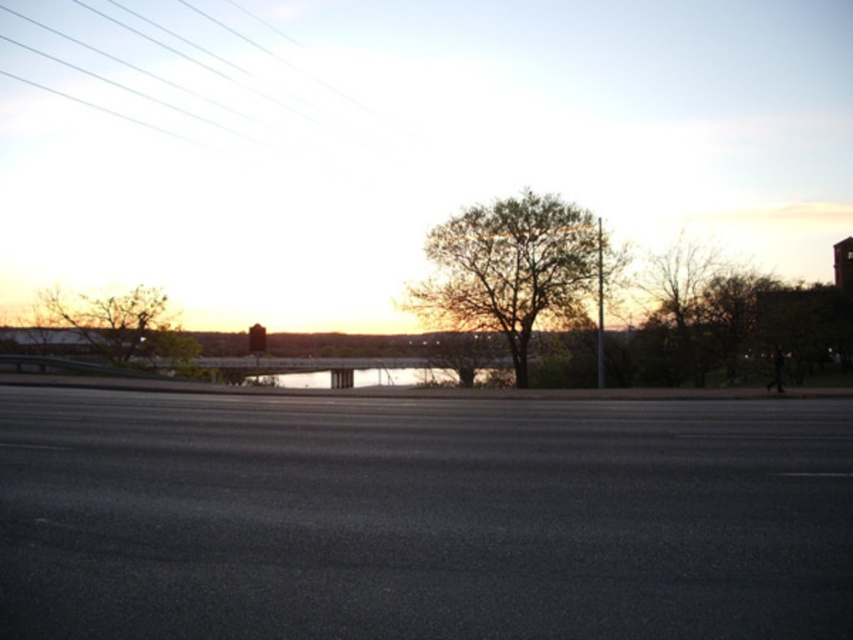
Question: Does clear glass power lines at upper left have a larger size compared to green leafy tree at center?

Choices:
 (A) yes
 (B) no

Answer: (A)

Question: Is green leafy tree at center bigger than green leafy tree at left?

Choices:
 (A) no
 (B) yes

Answer: (B)

Question: Which object appears farthest from the camera in this image?

Choices:
 (A) bare branches at right
 (B) clear glass power lines at upper left
 (C) green leafy tree at center

Answer: (B)

Question: Where is green leafy tree at center located in relation to green leafy tree at left in the image?

Choices:
 (A) above
 (B) below

Answer: (A)

Question: Which point is closer to the camera?

Choices:
 (A) (47, 56)
 (B) (144, 333)
 (C) (659, 276)

Answer: (C)

Question: Which point is farther from the camera taking this photo?

Choices:
 (A) (688, 344)
 (B) (158, 48)
 (C) (502, 260)

Answer: (B)